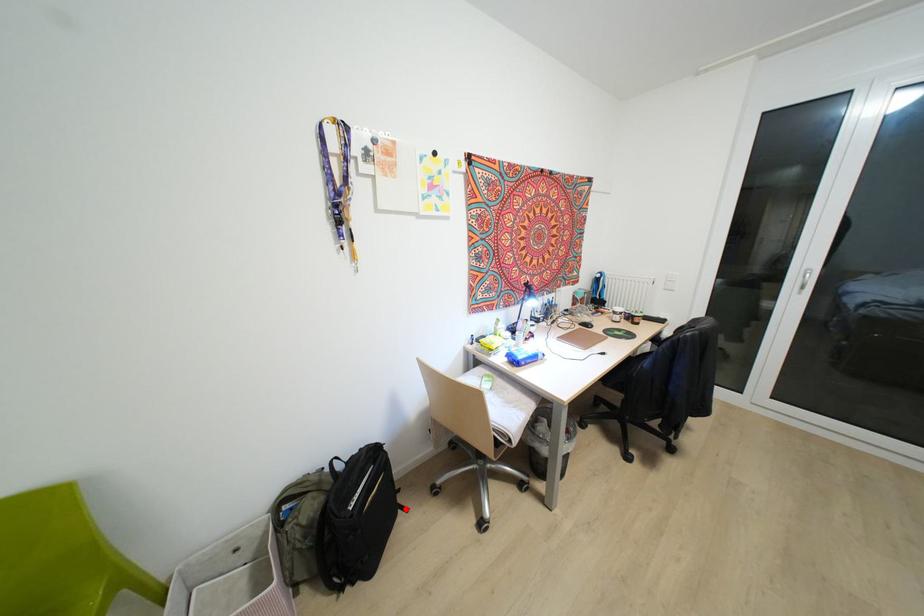
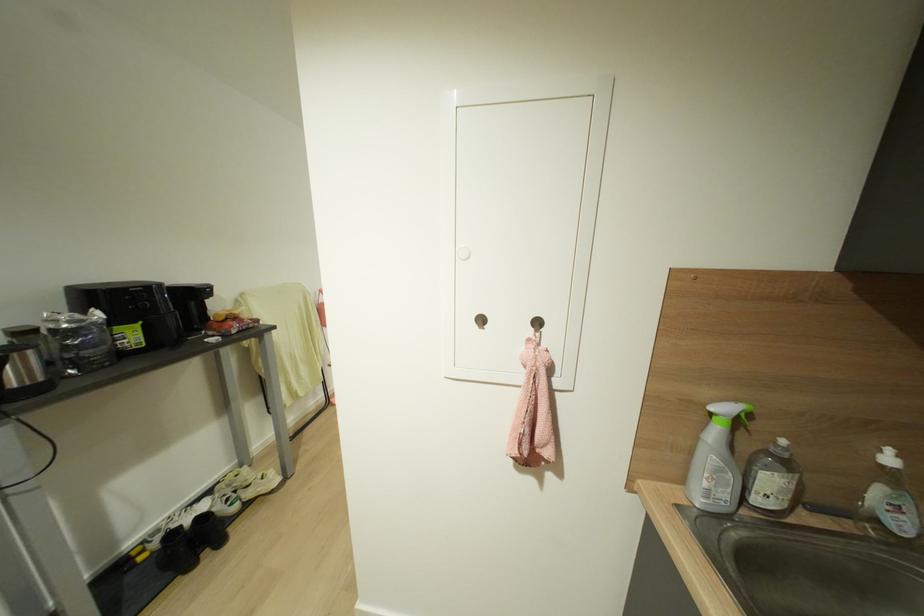
Question: I am providing you with two images of the same scene from different viewpoints. A red point is marked on the first image. Can you still see the location of the red point in image 2?

Choices:
 (A) Yes
 (B) No

Answer: (B)